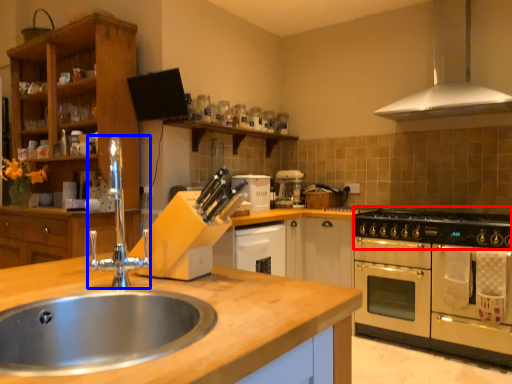
Question: Among these objects, which one is nearest to the camera, gas stove (highlighted by a red box) or tap (highlighted by a blue box)?

Choices:
 (A) gas stove
 (B) tap

Answer: (B)